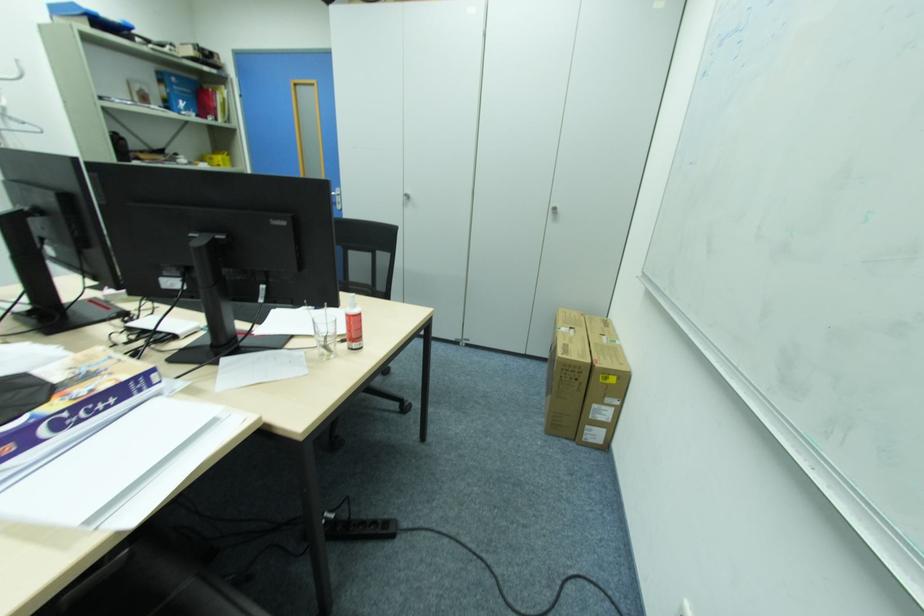
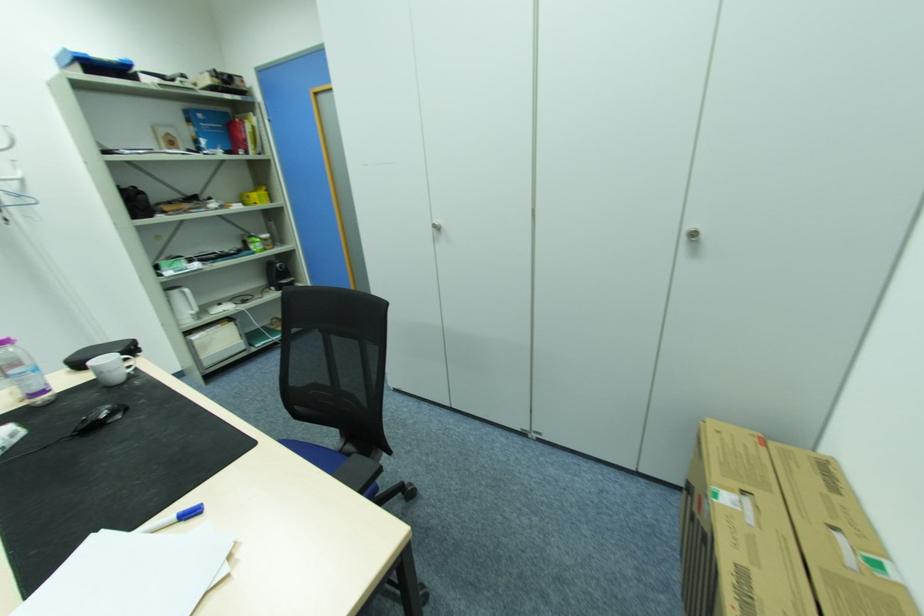
Question: Which direction would the cameraman need to move to produce the second image? Reply with the corresponding letter.

Choices:
 (A) Left
 (B) Right
 (C) Forward
 (D) Backward

Answer: (C)